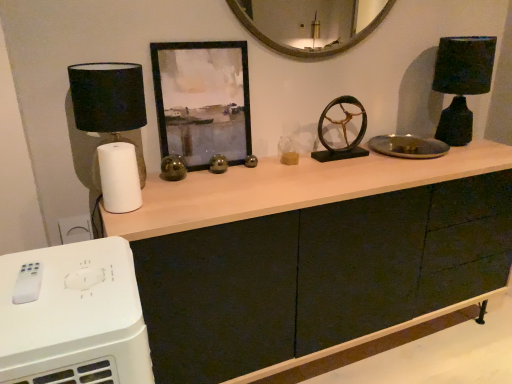
Question: Is the depth of white plastic remote control at lower left greater than that of bronze metallic wheel at center?

Choices:
 (A) yes
 (B) no

Answer: (B)

Question: Considering the relative sizes of white plastic remote control at lower left and bronze metallic wheel at center in the image provided, is white plastic remote control at lower left shorter than bronze metallic wheel at center?

Choices:
 (A) yes
 (B) no

Answer: (B)

Question: Is white plastic remote control at lower left positioned with its back to bronze metallic wheel at center?

Choices:
 (A) no
 (B) yes

Answer: (A)

Question: Can you confirm if white plastic remote control at lower left is taller than bronze metallic wheel at center?

Choices:
 (A) yes
 (B) no

Answer: (A)

Question: Can you confirm if white plastic remote control at lower left is positioned to the right of bronze metallic wheel at center?

Choices:
 (A) no
 (B) yes

Answer: (A)

Question: Would you say white plastic remote control at lower left is outside bronze metallic wheel at center?

Choices:
 (A) yes
 (B) no

Answer: (A)

Question: From a real-world perspective, is matte black cabinet at center under black matte picture frame at center?

Choices:
 (A) no
 (B) yes

Answer: (B)

Question: From the image's perspective, is matte black cabinet at center on top of black matte picture frame at center?

Choices:
 (A) no
 (B) yes

Answer: (A)

Question: Does matte black cabinet at center have a lesser width compared to black matte picture frame at center?

Choices:
 (A) yes
 (B) no

Answer: (B)

Question: Are matte black cabinet at center and black matte picture frame at center located far from each other?

Choices:
 (A) no
 (B) yes

Answer: (A)

Question: Considering the relative positions of matte black cabinet at center and black matte picture frame at center in the image provided, is matte black cabinet at center to the right of black matte picture frame at center from the viewer's perspective?

Choices:
 (A) no
 (B) yes

Answer: (B)

Question: Considering the relative sizes of matte black cabinet at center and black matte picture frame at center in the image provided, is matte black cabinet at center wider than black matte picture frame at center?

Choices:
 (A) yes
 (B) no

Answer: (A)

Question: Is black matte picture frame at center at the left side of matte black cabinet at center?

Choices:
 (A) yes
 (B) no

Answer: (A)